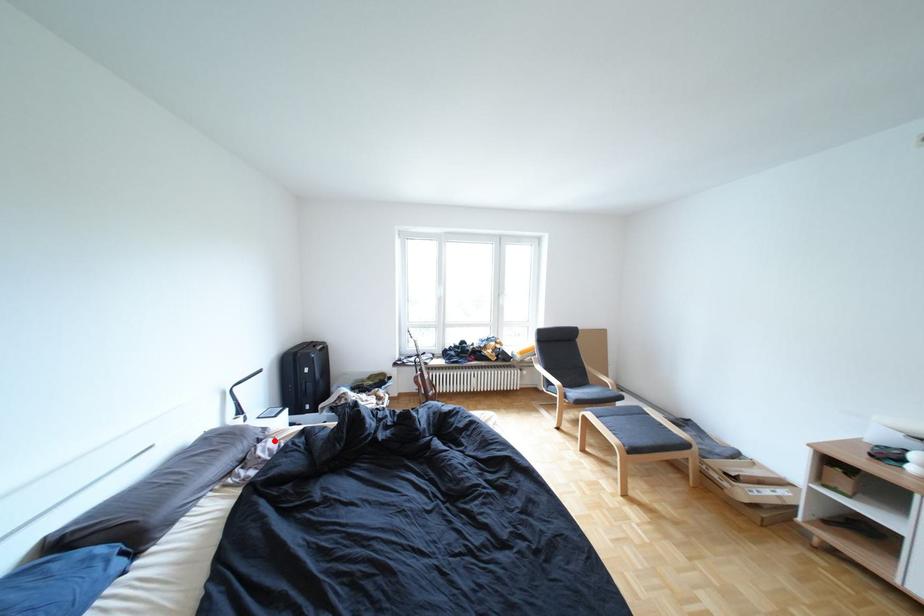
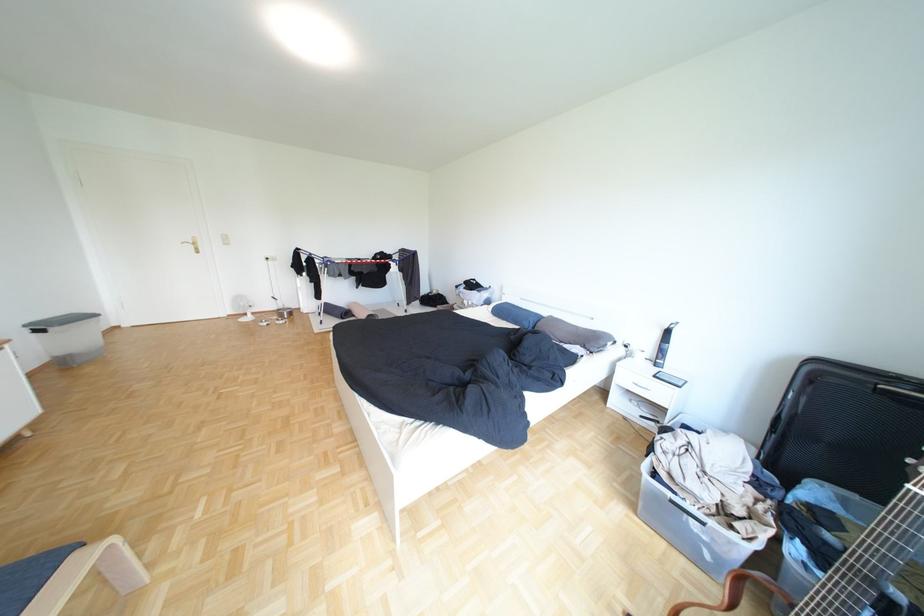
Question: I am providing you with two images of the same scene from different viewpoints. Image1 has a red point marked. In image2, the corresponding 3D location appears at what relative position? Reply with the corresponding letter.

Choices:
 (A) Closer
 (B) Farther

Answer: (B)